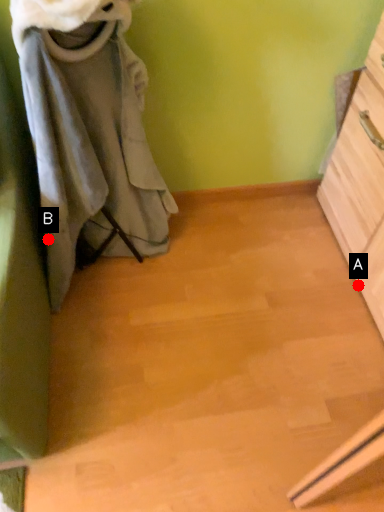
Question: Two points are circled on the image, labeled by A and B beside each circle. Which of the following is the closest to the observer?

Choices:
 (A) A is closer
 (B) B is closer

Answer: (B)